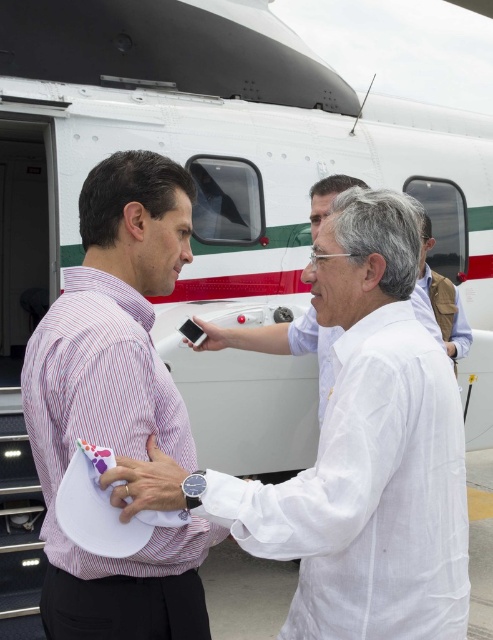
Question: Where is white cotton shirt at center located in relation to striped cotton shirt at center in the image?

Choices:
 (A) left
 (B) right

Answer: (B)

Question: Which point appears farthest from the camera in this image?

Choices:
 (A) (121, 516)
 (B) (132, 348)
 (C) (438, 428)
 (D) (212, 330)

Answer: (D)

Question: Which object is closer to the camera taking this photo?

Choices:
 (A) white cotton shirt at center
 (B) striped cotton shirt at center

Answer: (A)

Question: Among these objects, which one is farthest from the camera?

Choices:
 (A) striped cotton shirt at center
 (B) matte black phone at center
 (C) matte white paper at center
 (D) white cotton shirt at center

Answer: (B)

Question: Can you confirm if matte white paper at center is thinner than matte black phone at center?

Choices:
 (A) no
 (B) yes

Answer: (B)

Question: Is matte white paper at center smaller than matte black phone at center?

Choices:
 (A) no
 (B) yes

Answer: (A)